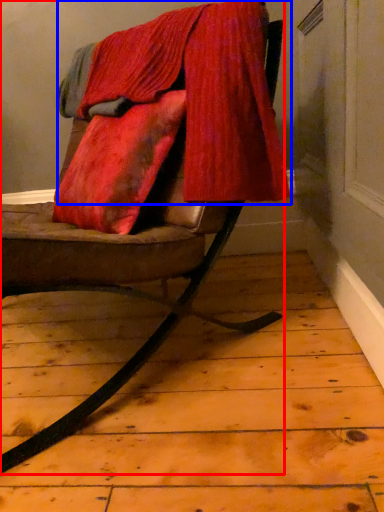
Question: Which point is further to the camera, chair (highlighted by a red box) or velvet (highlighted by a blue box)?

Choices:
 (A) chair
 (B) velvet

Answer: (B)